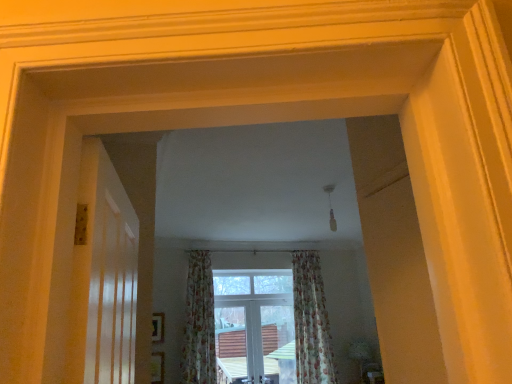
Question: Can you confirm if floral fabric curtain at center, the first curtain positioned from the left, is shorter than floral fabric curtain at center, which is counted as the second curtain, starting from the left?

Choices:
 (A) no
 (B) yes

Answer: (B)

Question: Can you confirm if floral fabric curtain at center, the first curtain positioned from the left, is taller than floral fabric curtain at center, which is counted as the second curtain, starting from the left?

Choices:
 (A) no
 (B) yes

Answer: (A)

Question: Is floral fabric curtain at center, the first curtain positioned from the left, at the left side of floral fabric curtain at center, which is counted as the first curtain, starting from the right?

Choices:
 (A) no
 (B) yes

Answer: (B)

Question: Is floral fabric curtain at center, which is counted as the second curtain, starting from the left, located within floral fabric curtain at center, arranged as the second curtain when viewed from the right?

Choices:
 (A) no
 (B) yes

Answer: (A)

Question: Does floral fabric curtain at center, arranged as the second curtain when viewed from the right, have a larger size compared to floral fabric curtain at center, which is counted as the first curtain, starting from the right?

Choices:
 (A) yes
 (B) no

Answer: (B)

Question: Looking at their shapes, would you say floral fabric curtain at center, which is counted as the first curtain, starting from the right, is wider or thinner than clear glass window at center?

Choices:
 (A) wide
 (B) thin

Answer: (A)

Question: Considering the positions of floral fabric curtain at center, which is counted as the first curtain, starting from the right, and clear glass window at center in the image, is floral fabric curtain at center, which is counted as the first curtain, starting from the right, bigger or smaller than clear glass window at center?

Choices:
 (A) big
 (B) small

Answer: (A)

Question: From the image's perspective, relative to clear glass window at center, is floral fabric curtain at center, which is counted as the first curtain, starting from the right, above or below?

Choices:
 (A) below
 (B) above

Answer: (B)

Question: Visually, is floral fabric curtain at center, which is counted as the first curtain, starting from the right, positioned to the left or to the right of clear glass window at center?

Choices:
 (A) left
 (B) right

Answer: (B)

Question: From the image's perspective, is floral fabric curtain at center, the first curtain positioned from the left, above or below clear glass window at center?

Choices:
 (A) below
 (B) above

Answer: (B)

Question: Is point (202, 354) closer or farther from the camera than point (224, 352)?

Choices:
 (A) farther
 (B) closer

Answer: (B)

Question: In the image, is floral fabric curtain at center, the first curtain positioned from the left, positioned in front of or behind clear glass window at center?

Choices:
 (A) behind
 (B) front

Answer: (B)

Question: Considering the positions of floral fabric curtain at center, the first curtain positioned from the left, and clear glass window at center in the image, is floral fabric curtain at center, the first curtain positioned from the left, bigger or smaller than clear glass window at center?

Choices:
 (A) small
 (B) big

Answer: (B)

Question: Is floral fabric curtain at center, which is counted as the first curtain, starting from the right, inside the boundaries of floral fabric curtain at center, the first curtain positioned from the left, or outside?

Choices:
 (A) inside
 (B) outside

Answer: (B)

Question: Considering the positions of point (303, 299) and point (198, 269), is point (303, 299) closer or farther from the camera than point (198, 269)?

Choices:
 (A) farther
 (B) closer

Answer: (A)